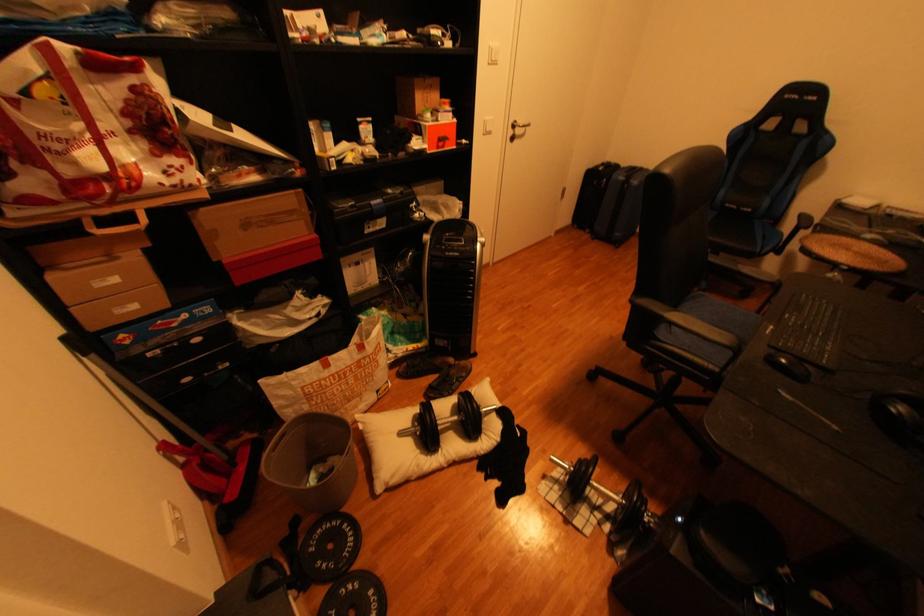
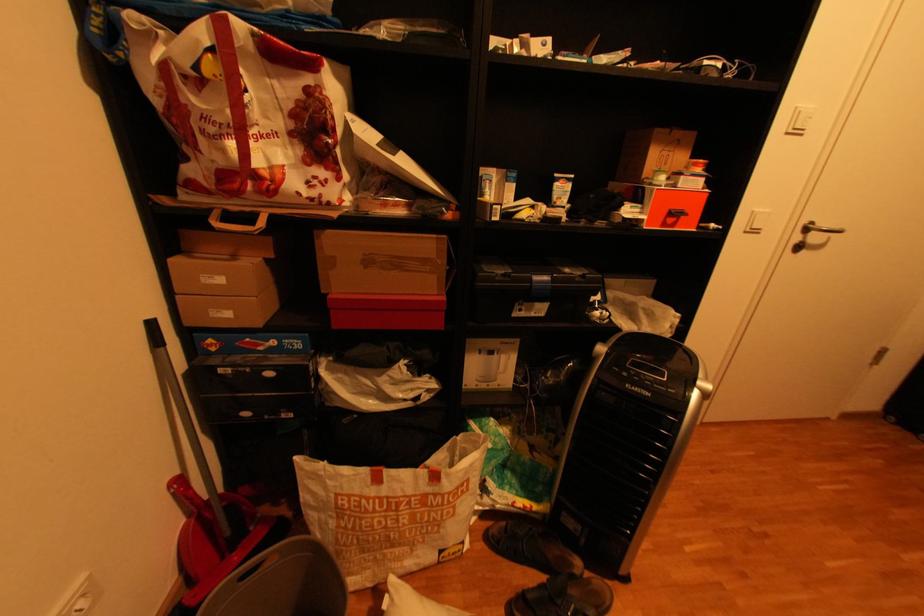
Locate, in the second image, the point that corresponds to [306,193] in the first image.

(446, 238)